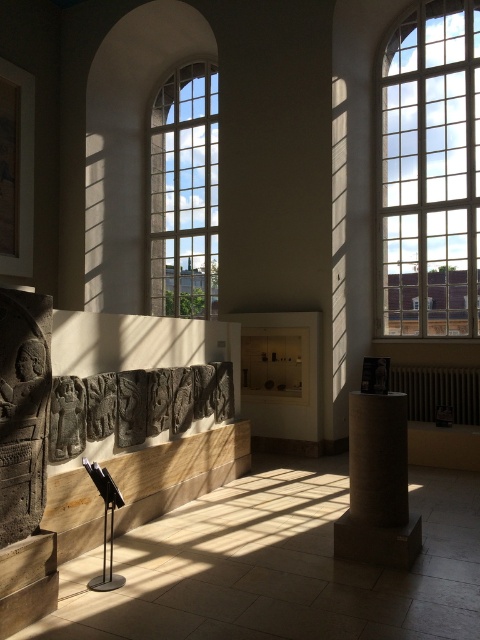
Is clear glass window at upper right behind matte stone column at center?

Yes, it is behind matte stone column at center.

In the scene shown: How distant is clear glass window at upper right from matte stone column at center?

They are 5.11 meters apart.

What are the coordinates of `clear glass window at upper right` in the screenshot? It's located at (431, 172).

Is point (361, 451) positioned in front of point (58, 449)?

That is False.

Is matte stone column at center to the right of dark gray stone carving at center from the viewer's perspective?

Indeed, matte stone column at center is positioned on the right side of dark gray stone carving at center.

The width and height of the screenshot is (480, 640). Describe the element at coordinates (377, 484) in the screenshot. I see `matte stone column at center` at that location.

The height and width of the screenshot is (640, 480). What are the coordinates of `matte stone column at center` in the screenshot? It's located at coord(377,484).

Looking at this image, who is lower down, clear glass window at center or dark gray stone carving at center?

Positioned lower is dark gray stone carving at center.

Between clear glass window at center and dark gray stone carving at center, which one is positioned higher?

clear glass window at center

At what (x,y) coordinates should I click in order to perform the action: click on clear glass window at center. Please return your answer as a coordinate pair (x, y). The image size is (480, 640). Looking at the image, I should click on (184, 195).

Find the location of a particular element. clear glass window at center is located at coordinates (184, 195).